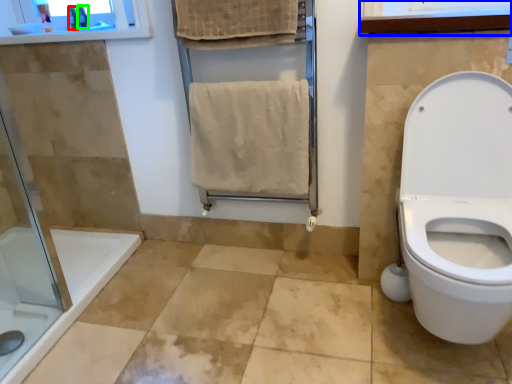
Question: Which is farther away from toiletry (highlighted by a red box)? medicine cabinet (highlighted by a blue box) or toiletry (highlighted by a green box)?

Choices:
 (A) medicine cabinet
 (B) toiletry

Answer: (A)